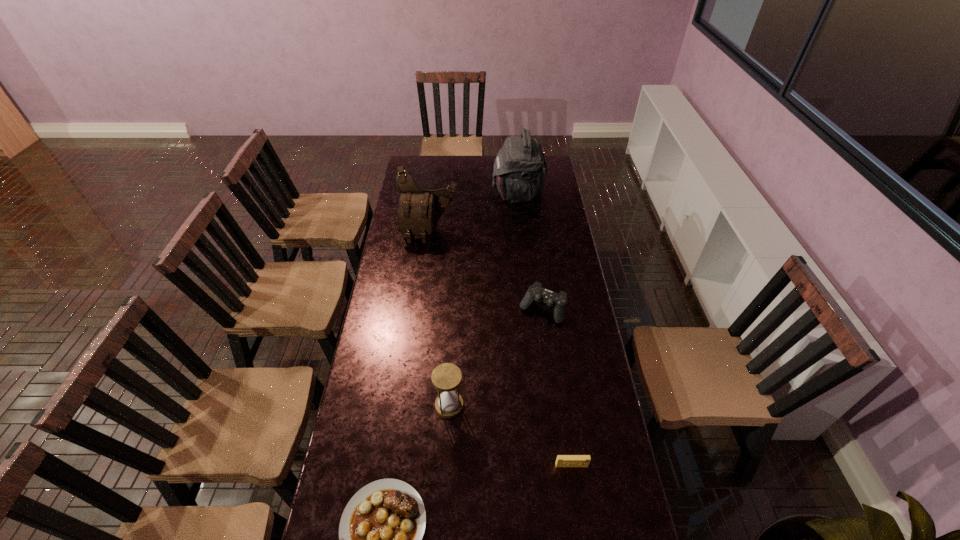
Find the location of `control that is at the right edge`. control that is at the right edge is located at coordinates (536, 293).

This screenshot has height=540, width=960. What are the coordinates of `videotape that is at the right edge` in the screenshot? It's located at (562, 460).

Identify the location of object present at the far right corner. (520, 168).

The image size is (960, 540). Identify the location of free point at the far edge. (442, 166).

You are a GUI agent. You are given a task and a screenshot of the screen. Output one action in this format:
    pyautogui.click(x=<x>, y=<y>)
    Task: Click on the vacant space at the left edge of the desktop
    
    Given the screenshot: What is the action you would take?
    pyautogui.click(x=414, y=181)

In the image, there is a desktop. At what (x,y) coordinates should I click in order to perform the action: click on vacant space at the right edge. Please return your answer as a coordinate pair (x, y). Looking at the image, I should click on (600, 440).

What are the coordinates of `unoccupied position between the fourth shortest object and the videotape` in the screenshot? It's located at (511, 435).

Where is `vacant region between the videotape and the farthest object`? The image size is (960, 540). vacant region between the videotape and the farthest object is located at coordinates (544, 329).

Where is `free spot between the nearer shoulder bag and the videotape`? Image resolution: width=960 pixels, height=540 pixels. free spot between the nearer shoulder bag and the videotape is located at coordinates (500, 349).

This screenshot has height=540, width=960. I want to click on vacant region between the fifth tallest object and the left shoulder bag, so [x=500, y=349].